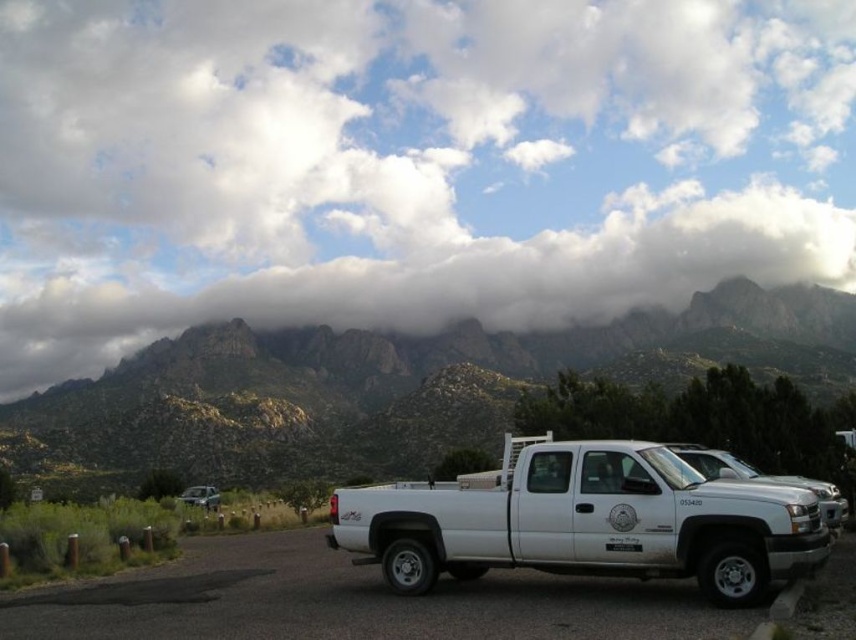
You are a photographer planning to take a wide shot of the rugged stone mountains at upper center and the white matte truck at center. Based on their relative widths, which object should you position closer to the edge of the frame to ensure both fit in the shot?

The rugged stone mountains at upper center might be wider than the white matte truck at center, so positioning the mountains closer to the edge of the frame would help ensure both fit in the shot.

You are a photographer planning to take a photo of the rugged stone mountains at upper center and the white matte truck at center. Since you want the mountains to appear larger in the photo than the truck, which object should be closer to the camera?

The rugged stone mountains at upper center are much taller than the white matte truck at center, so to make them appear larger in the photo, you should position the rugged stone mountains at upper center closer to the camera.